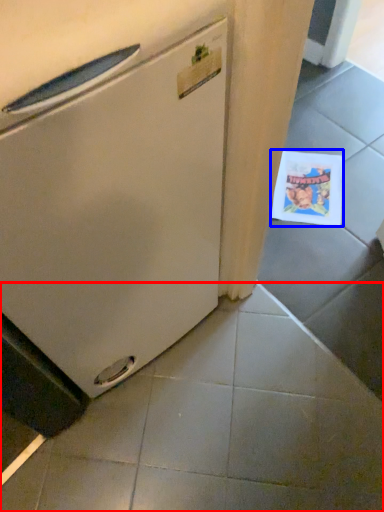
Question: Among these objects, which one is nearest to the camera, tile (highlighted by a red box) or postcard (highlighted by a blue box)?

Choices:
 (A) tile
 (B) postcard

Answer: (A)